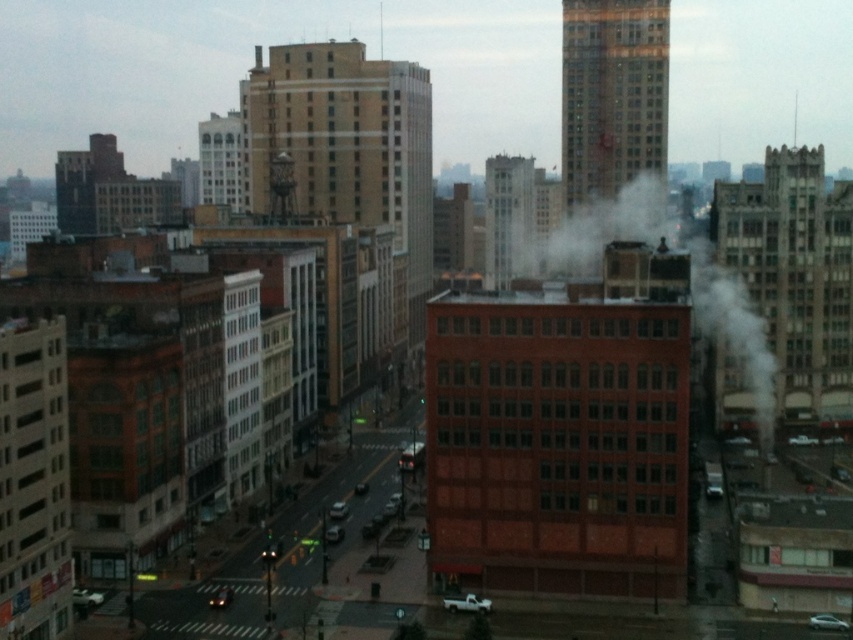
Question: Estimate the real-world distances between objects in this image. Which object is farther from the brick building at left?

Choices:
 (A) brick building at upper right
 (B) smooth white tower at center

Answer: (B)

Question: Which of the following is the farthest from the observer?

Choices:
 (A) (693, 305)
 (B) (532, 163)
 (C) (12, 531)
 (D) (376, 173)

Answer: (B)

Question: Which of the following is the closest to the observer?

Choices:
 (A) (593, 83)
 (B) (19, 477)
 (C) (422, 115)

Answer: (B)

Question: Is beige brick building at center bigger than white smoke at center?

Choices:
 (A) yes
 (B) no

Answer: (B)

Question: Is brick building at left bigger than brick building at upper right?

Choices:
 (A) yes
 (B) no

Answer: (B)

Question: Observing the image, what is the correct spatial positioning of brick building at left in reference to brick building at upper right?

Choices:
 (A) right
 (B) left

Answer: (B)